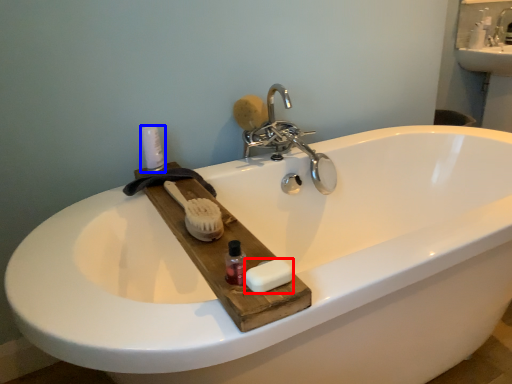
Question: Which object appears farthest to the camera in this image, soap (highlighted by a red box) or toiletry (highlighted by a blue box)?

Choices:
 (A) soap
 (B) toiletry

Answer: (B)